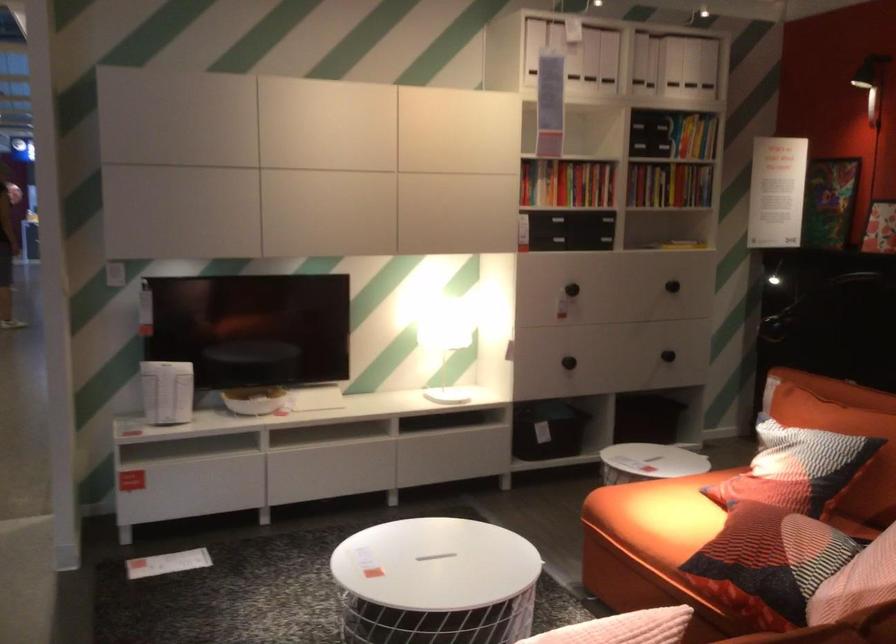
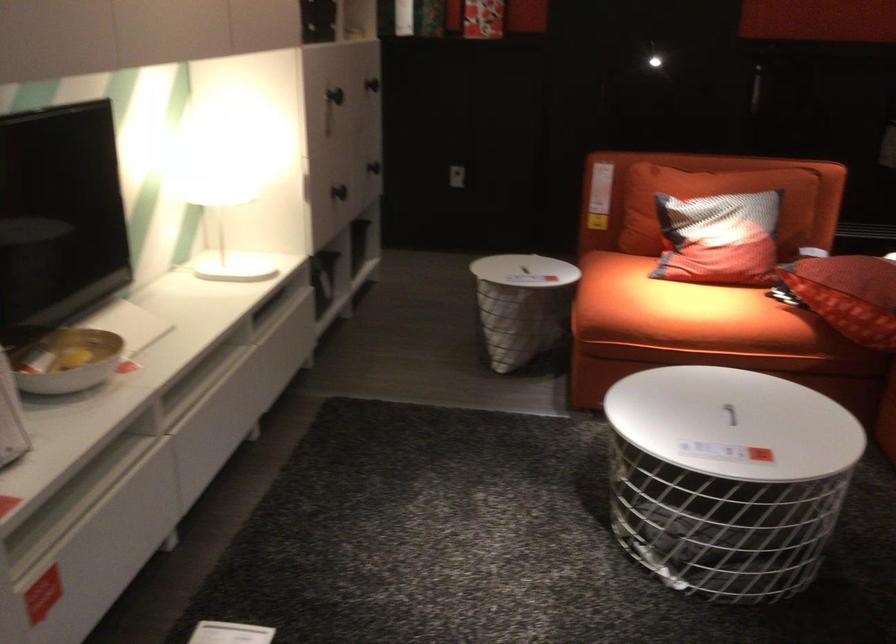
The point at (356, 436) is marked in the first image. Where is the corresponding point in the second image?

(200, 381)